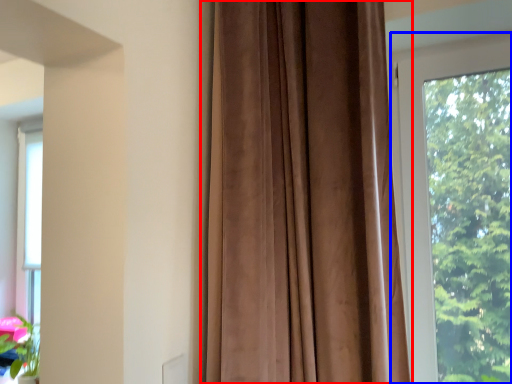
Question: Which object appears farthest to the camera in this image, curtain (highlighted by a red box) or window (highlighted by a blue box)?

Choices:
 (A) curtain
 (B) window

Answer: (B)